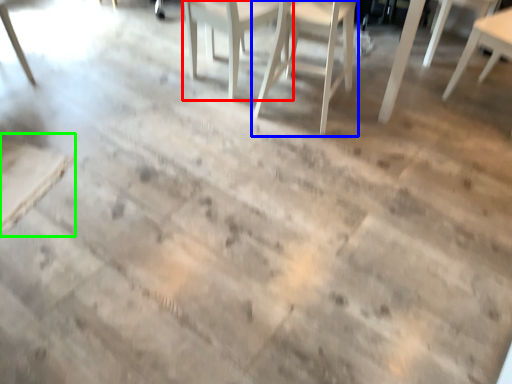
Question: Which is nearer to the chair (highlighted by a red box)? chair (highlighted by a blue box) or table (highlighted by a green box).

Choices:
 (A) chair
 (B) table

Answer: (A)